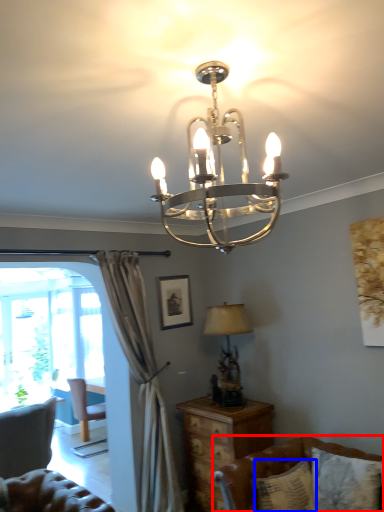
Question: Which point is further to the camera, studio couch (highlighted by a red box) or pillow (highlighted by a blue box)?

Choices:
 (A) studio couch
 (B) pillow

Answer: (B)